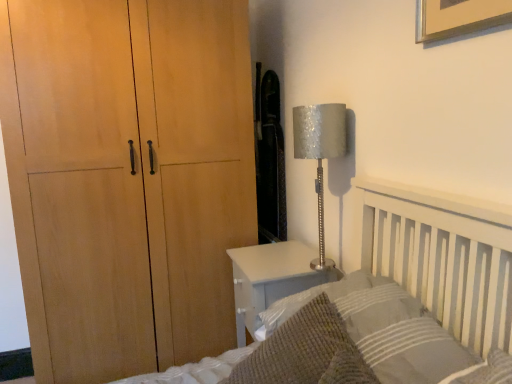
Question: Is knitted wool throw pillow at lower right facing away from silver textured lampshade at right?

Choices:
 (A) no
 (B) yes

Answer: (A)

Question: Is knitted wool throw pillow at lower right smaller than silver textured lampshade at right?

Choices:
 (A) no
 (B) yes

Answer: (A)

Question: From the image's perspective, is knitted wool throw pillow at lower right on top of silver textured lampshade at right?

Choices:
 (A) no
 (B) yes

Answer: (A)

Question: Is silver textured lampshade at right surrounded by knitted wool throw pillow at lower right?

Choices:
 (A) yes
 (B) no

Answer: (B)

Question: Does knitted wool throw pillow at lower right turn towards silver textured lampshade at right?

Choices:
 (A) yes
 (B) no

Answer: (B)

Question: Does knitted wool throw pillow at lower right come behind silver textured lampshade at right?

Choices:
 (A) yes
 (B) no

Answer: (B)

Question: Is textured gray pillow at lower right facing away from white glossy nightstand at lower right?

Choices:
 (A) no
 (B) yes

Answer: (A)

Question: Is textured gray pillow at lower right at the right side of white glossy nightstand at lower right?

Choices:
 (A) yes
 (B) no

Answer: (A)

Question: Would you say white glossy nightstand at lower right is part of textured gray pillow at lower right's contents?

Choices:
 (A) no
 (B) yes

Answer: (A)

Question: Does textured gray pillow at lower right turn towards white glossy nightstand at lower right?

Choices:
 (A) no
 (B) yes

Answer: (A)

Question: From a real-world perspective, is textured gray pillow at lower right over white glossy nightstand at lower right?

Choices:
 (A) yes
 (B) no

Answer: (A)

Question: From a real-world perspective, is textured gray pillow at lower right positioned under white glossy nightstand at lower right based on gravity?

Choices:
 (A) no
 (B) yes

Answer: (A)

Question: Is silver textured lampshade at right oriented towards white glossy nightstand at lower right?

Choices:
 (A) yes
 (B) no

Answer: (B)